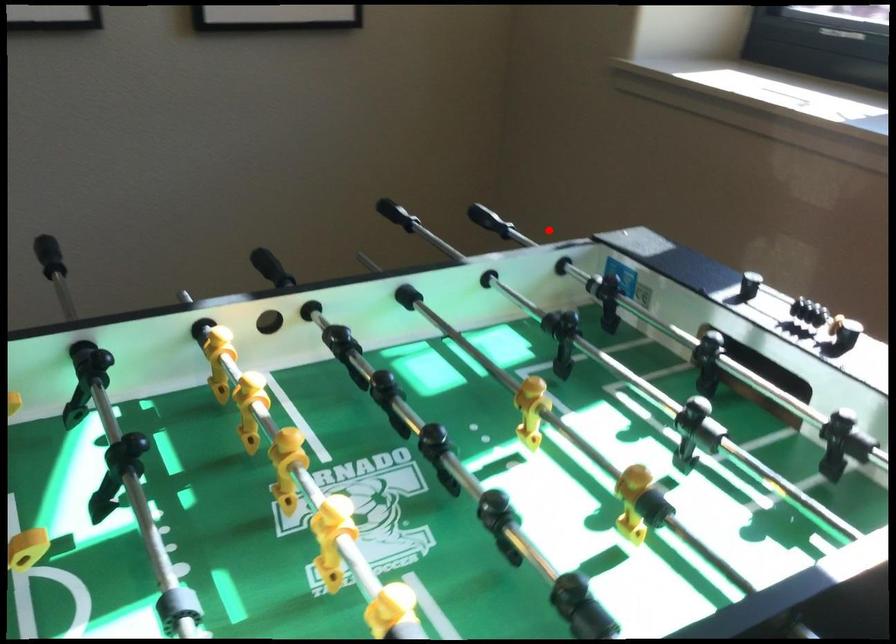
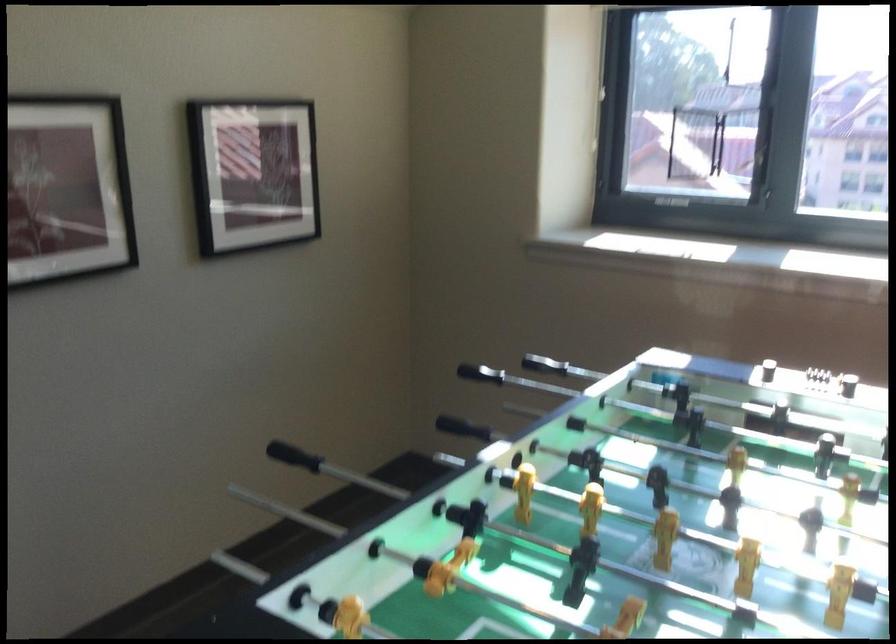
Question: I am providing you with two images of the same scene from different viewpoints. In image1, a red point is highlighted. Considering the same 3D point in image2, which of the following is correct?

Choices:
 (A) It is closer
 (B) It is farther

Answer: (B)